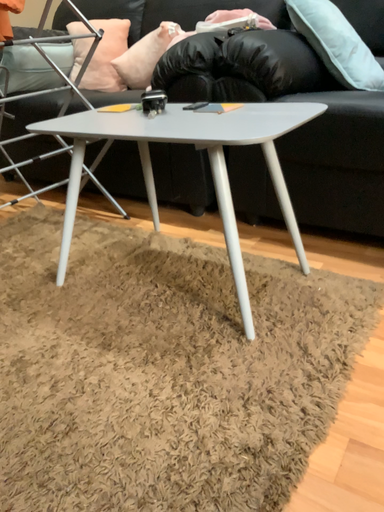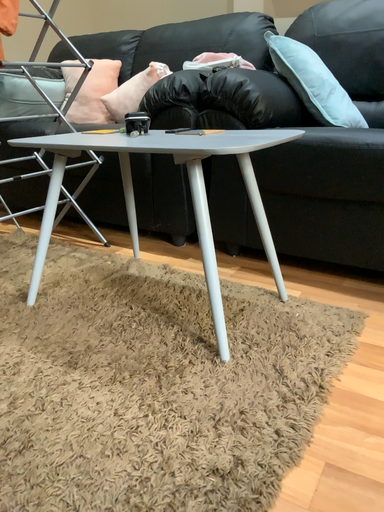
Question: Which way did the camera rotate in the video?

Choices:
 (A) rotated downward
 (B) rotated upward

Answer: (B)